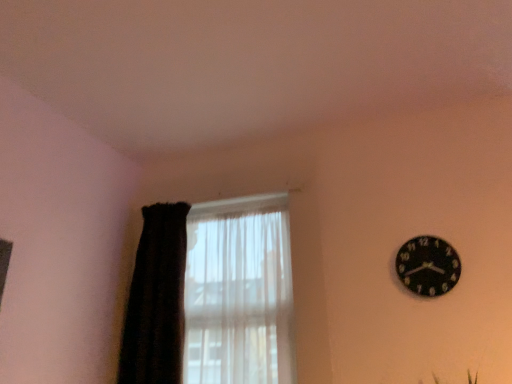
What do you see at coordinates (211, 295) in the screenshot? I see `translucent fabric at left` at bounding box center [211, 295].

In order to face black fuzzy curtain at left, should I rotate leftwards or rightwards?

Rotate your view left by about 12.720°.

Identify the location of translucent fabric at left. (211, 295).

Does point (132, 355) come behind point (417, 289)?

Yes, point (132, 355) is farther from viewer.

From the image's perspective, which is below, black fuzzy curtain at left or black matte clock at upper right?

black fuzzy curtain at left, from the image's perspective.

Between black fuzzy curtain at left and black matte clock at upper right, which one appears on the right side from the viewer's perspective?

black matte clock at upper right is more to the right.

Looking at this image, is black fuzzy curtain at left bigger than black matte clock at upper right?

Yes, black fuzzy curtain at left is bigger than black matte clock at upper right.

Is translucent fabric at left positioned with its back to black matte clock at upper right?

No, black matte clock at upper right is not at the back of translucent fabric at left.

Where is `window behind the black matte clock at upper right`? The width and height of the screenshot is (512, 384). window behind the black matte clock at upper right is located at coordinates (211, 295).

From the image's perspective, is translucent fabric at left positioned above or below black matte clock at upper right?

Clearly, from the image's perspective, translucent fabric at left is below black matte clock at upper right.

Between black matte clock at upper right and black fuzzy curtain at left, which one is positioned in front?

black matte clock at upper right is in front.

Is black matte clock at upper right thinner than black fuzzy curtain at left?

Indeed, black matte clock at upper right has a lesser width compared to black fuzzy curtain at left.

From a real-world perspective, which object rests below the other?

From a 3D spatial view, black fuzzy curtain at left is below.

From their relative heights in the image, would you say black matte clock at upper right is taller or shorter than black fuzzy curtain at left?

black matte clock at upper right is shorter than black fuzzy curtain at left.

From the picture: Does black fuzzy curtain at left turn towards translucent fabric at left?

Yes, black fuzzy curtain at left is facing translucent fabric at left.

The height and width of the screenshot is (384, 512). Find the location of `curtain to the left of translucent fabric at left`. curtain to the left of translucent fabric at left is located at coordinates (156, 300).

In terms of width, does black fuzzy curtain at left look wider or thinner when compared to translucent fabric at left?

In the image, black fuzzy curtain at left appears to be wider than translucent fabric at left.

Is black fuzzy curtain at left closer to the viewer compared to translucent fabric at left?

No, black fuzzy curtain at left is further to the viewer.

In order to click on curtain that is above the translucent fabric at left (from the image's perspective) in this screenshot , I will do `click(156, 300)`.

From the picture: Considering the sizes of objects translucent fabric at left and black fuzzy curtain at left in the image provided, who is taller, translucent fabric at left or black fuzzy curtain at left?

Standing taller between the two is black fuzzy curtain at left.

Who is bigger, translucent fabric at left or black fuzzy curtain at left?

translucent fabric at left is bigger.

Based on their positions, is translucent fabric at left located to the left or right of black fuzzy curtain at left?

Based on their positions, translucent fabric at left is located to the right of black fuzzy curtain at left.

Can you confirm if black matte clock at upper right is thinner than translucent fabric at left?

Yes.

Which is more to the left, black matte clock at upper right or translucent fabric at left?

translucent fabric at left.

Is black matte clock at upper right looking in the opposite direction of translucent fabric at left?

No, black matte clock at upper right is not facing away from translucent fabric at left.

Can you tell me how much black matte clock at upper right and translucent fabric at left differ in facing direction?

They differ by 0.57 degrees in their facing directions.

This screenshot has width=512, height=384. What are the coordinates of `curtain below the black matte clock at upper right (from a real-world perspective)` in the screenshot? It's located at (156, 300).

In the image, there is a translucent fabric at left. At what (x,y) coordinates should I click in order to perform the action: click on wall clock above it (from the image's perspective). Please return your answer as a coordinate pair (x, y). Looking at the image, I should click on (428, 266).

From the image, which object appears to be nearer to black fuzzy curtain at left, black matte clock at upper right or translucent fabric at left?

Among the two, translucent fabric at left is located nearer to black fuzzy curtain at left.

Estimate the real-world distances between objects in this image. Which object is further from black matte clock at upper right, translucent fabric at left or black fuzzy curtain at left?

black fuzzy curtain at left.

Which object lies nearer to the anchor point black matte clock at upper right, black fuzzy curtain at left or translucent fabric at left?

The object closer to black matte clock at upper right is translucent fabric at left.

From the picture: From the image, which object appears to be farther from black fuzzy curtain at left, translucent fabric at left or black matte clock at upper right?

black matte clock at upper right is positioned further to the anchor black fuzzy curtain at left.

Considering their positions, is black fuzzy curtain at left positioned further to translucent fabric at left than black matte clock at upper right?

black matte clock at upper right lies further to translucent fabric at left than the other object.

From the image, which object appears to be farther from translucent fabric at left, black matte clock at upper right or black fuzzy curtain at left?

black matte clock at upper right is further to translucent fabric at left.

In order to click on window situated between black fuzzy curtain at left and black matte clock at upper right from left to right in this screenshot , I will do `click(211, 295)`.